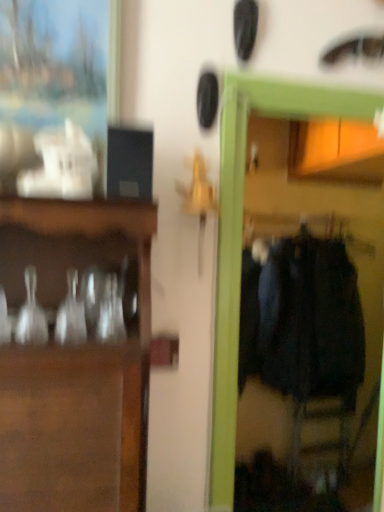
Question: Is dark blue fabric coat at right taller or shorter than clear glass vase at left?

Choices:
 (A) short
 (B) tall

Answer: (B)

Question: Do you think dark blue fabric coat at right is within clear glass vase at left, or outside of it?

Choices:
 (A) inside
 (B) outside

Answer: (B)

Question: Visually, is dark blue fabric coat at right positioned to the left or to the right of clear glass vase at left?

Choices:
 (A) left
 (B) right

Answer: (B)

Question: Visually, is clear glass vase at left positioned to the left or to the right of dark blue fabric coat at right?

Choices:
 (A) left
 (B) right

Answer: (A)

Question: From a real-world perspective, is clear glass vase at left above or below dark blue fabric coat at right?

Choices:
 (A) below
 (B) above

Answer: (B)

Question: Is clear glass vase at left wider or thinner than dark blue fabric coat at right?

Choices:
 (A) thin
 (B) wide

Answer: (A)

Question: Considering the positions of clear glass vase at left and dark blue fabric coat at right in the image, is clear glass vase at left taller or shorter than dark blue fabric coat at right?

Choices:
 (A) tall
 (B) short

Answer: (B)